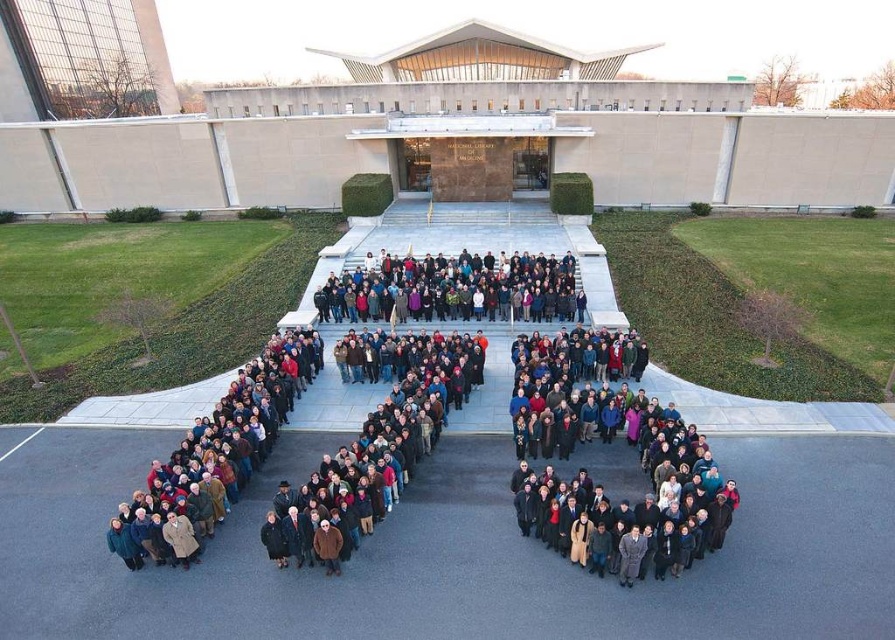
Question: Is dark brown coat at center thinner than dark gray fabric crowd at center?

Choices:
 (A) yes
 (B) no

Answer: (B)

Question: Which of the following is the farthest from the observer?

Choices:
 (A) (348, 358)
 (B) (344, 276)

Answer: (B)

Question: Is dark brown coat at center wider than dark gray fabric crowd at center?

Choices:
 (A) yes
 (B) no

Answer: (A)

Question: Which point is farther to the camera?

Choices:
 (A) (316, 374)
 (B) (329, 275)

Answer: (B)

Question: Does dark brown coat at center appear under dark gray fabric crowd at center?

Choices:
 (A) no
 (B) yes

Answer: (B)